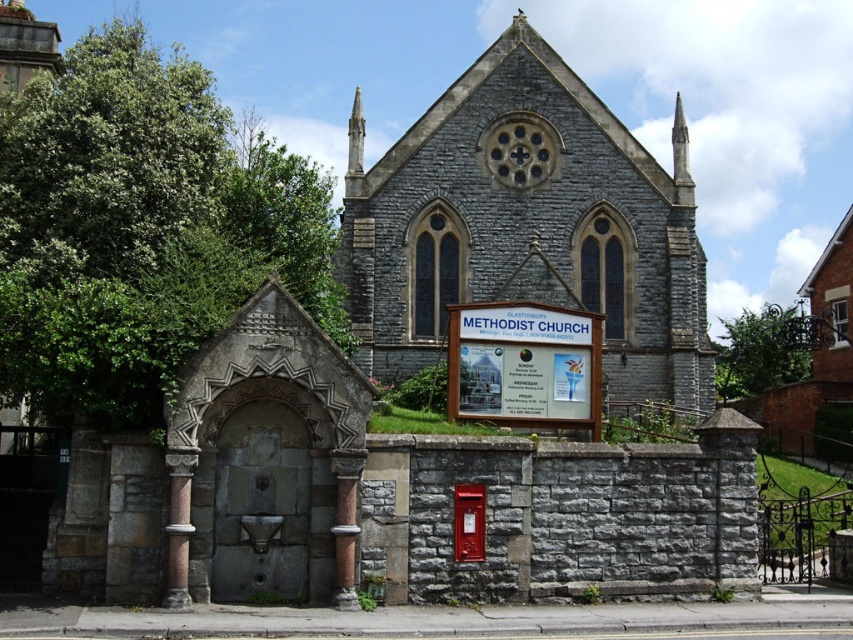
Question: Which point appears farthest from the camera in this image?

Choices:
 (A) (677, 172)
 (B) (521, 193)
 (C) (598, 428)

Answer: (A)

Question: Observing the image, what is the correct spatial positioning of gray stone chapel at center in reference to white stone spire at upper center?

Choices:
 (A) above
 (B) below

Answer: (B)

Question: Is gray stone chapel at center thinner than smooth stone spire at upper center?

Choices:
 (A) no
 (B) yes

Answer: (A)

Question: Considering the real-world distances, which object is closest to the white stone spire at upper center?

Choices:
 (A) smooth stone spire at upper center
 (B) gray stone chapel at center

Answer: (B)

Question: Does gray stone chapel at center appear on the right side of white wooden sign at center?

Choices:
 (A) yes
 (B) no

Answer: (A)

Question: Based on their relative distances, which object is nearer to the gray stone chapel at center?

Choices:
 (A) white wooden sign at center
 (B) white stone spire at upper center

Answer: (B)